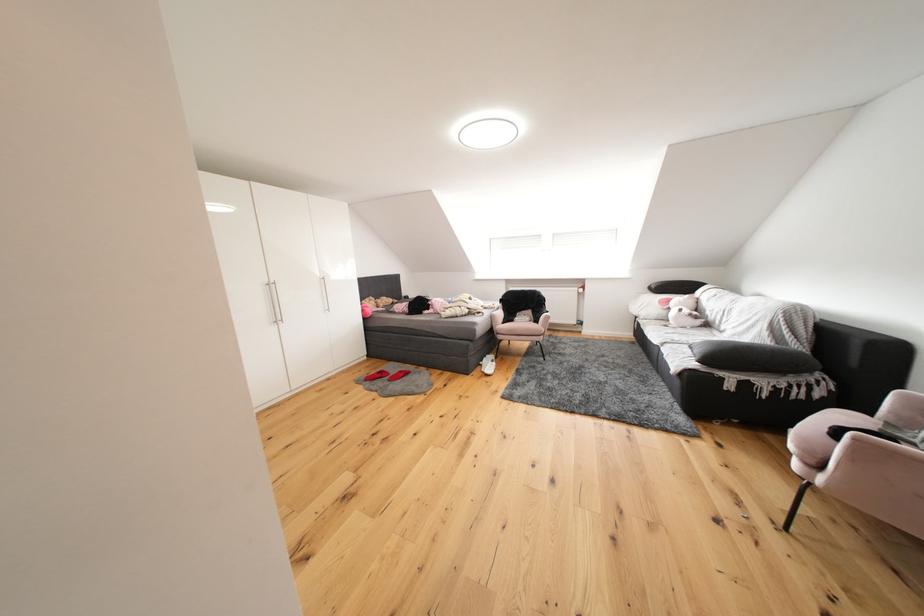
Describe the element at coordinates (676, 342) in the screenshot. This screenshot has width=924, height=616. I see `the sofa sitting surface` at that location.